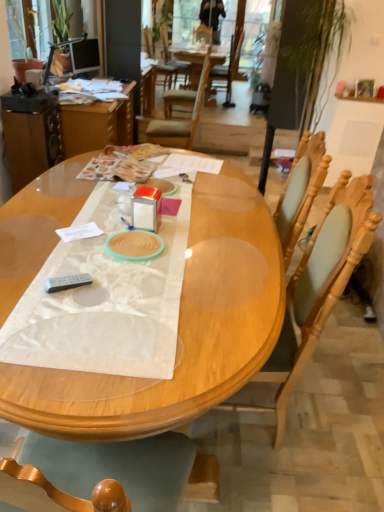
Question: Considering the relative sizes of green leafy plant at upper left, which ranks as the 2th houseplant in back-to-front order, and wooden chair at right, which is the second chair in top-to-bottom order, in the image provided, is green leafy plant at upper left, which ranks as the 2th houseplant in back-to-front order, wider than wooden chair at right, which is the second chair in top-to-bottom order,?

Choices:
 (A) yes
 (B) no

Answer: (B)

Question: Is green leafy plant at upper left, which ranks as the 2th houseplant in back-to-front order, positioned before wooden chair at right, which is the second chair from back to front?

Choices:
 (A) yes
 (B) no

Answer: (B)

Question: Is green leafy plant at upper left, which ranks as the 2th houseplant in back-to-front order, oriented away from wooden chair at right, placed as the first chair when sorted from bottom to top?

Choices:
 (A) no
 (B) yes

Answer: (A)

Question: Could you tell me if green leafy plant at upper left, which is counted as the 1th houseplant, starting from the front, is facing wooden chair at right, which is the second chair from back to front?

Choices:
 (A) no
 (B) yes

Answer: (A)

Question: Is green leafy plant at upper left, which is counted as the 1th houseplant, starting from the front, behind wooden chair at right, which is the second chair from back to front?

Choices:
 (A) no
 (B) yes

Answer: (B)

Question: Is there a large distance between green leafy plant at upper left, which ranks as the 2th houseplant in back-to-front order, and wooden chair at right, which is the first chair in front-to-back order?

Choices:
 (A) yes
 (B) no

Answer: (A)

Question: From a real-world perspective, is wooden chair at right, which is the first chair in front-to-back order, on wooden chair at center, the second chair viewed from the front?

Choices:
 (A) yes
 (B) no

Answer: (B)

Question: Is wooden chair at right, which is the second chair in top-to-bottom order, bigger than wooden chair at center, the second chair viewed from the front?

Choices:
 (A) no
 (B) yes

Answer: (B)

Question: Does wooden chair at right, which is the second chair in top-to-bottom order, have a greater width compared to wooden chair at center, which is the second chair from bottom to top?

Choices:
 (A) yes
 (B) no

Answer: (B)

Question: Is the depth of wooden chair at right, which is the second chair in top-to-bottom order, greater than that of wooden chair at center, the second chair viewed from the front?

Choices:
 (A) yes
 (B) no

Answer: (B)

Question: Can you confirm if wooden chair at right, which is the first chair in front-to-back order, is smaller than wooden chair at center, the second chair viewed from the front?

Choices:
 (A) yes
 (B) no

Answer: (B)

Question: Considering the relative positions of wooden chair at right, which is the first chair in front-to-back order, and wooden chair at center, the second chair viewed from the front, in the image provided, is wooden chair at right, which is the first chair in front-to-back order, in front of wooden chair at center, the second chair viewed from the front,?

Choices:
 (A) no
 (B) yes

Answer: (B)

Question: Can you confirm if wooden table at left is bigger than green leafy plant at upper left, which is counted as the 1th houseplant, starting from the front?

Choices:
 (A) yes
 (B) no

Answer: (A)